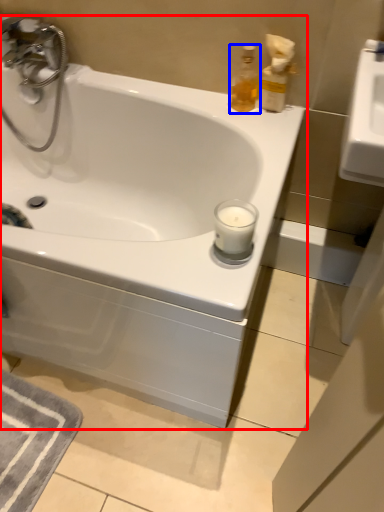
Question: Which object is closer to the camera taking this photo, bathtub (highlighted by a red box) or soap dispenser (highlighted by a blue box)?

Choices:
 (A) bathtub
 (B) soap dispenser

Answer: (A)